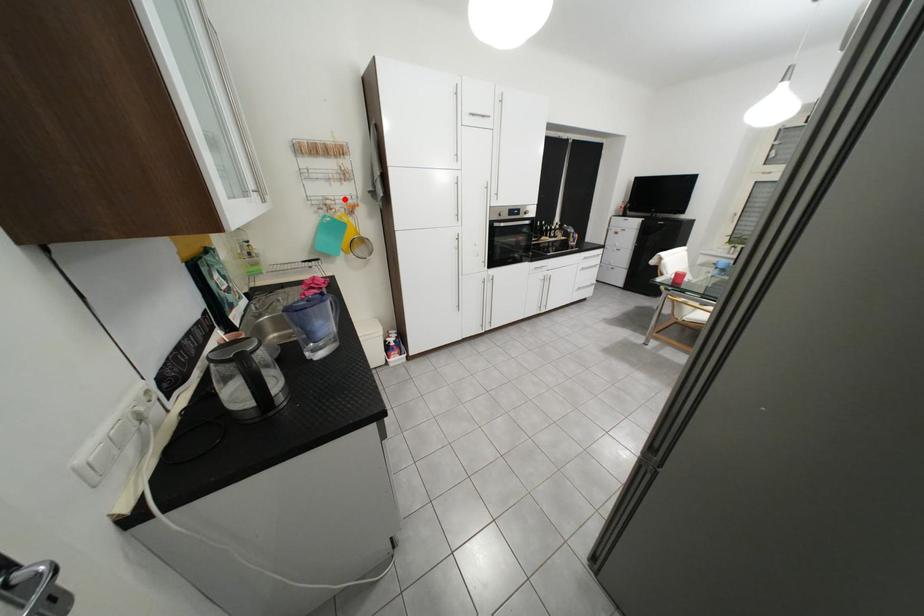
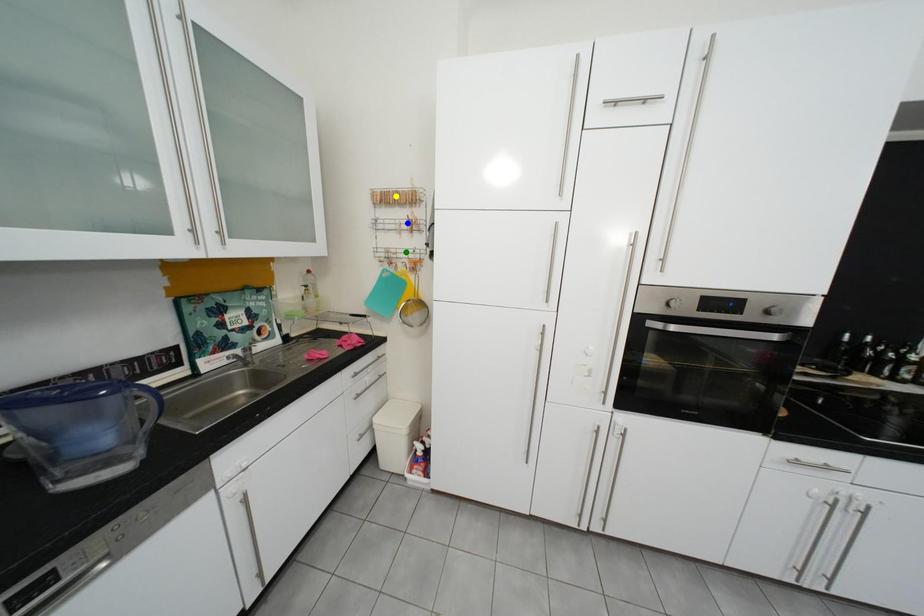
Question: I am providing you with two images of the same scene from different viewpoints. A red point is marked on the first image. You are given multiple points on the second image. Which spot in image 2 lines up with the point in image 1?

Choices:
 (A) yellow point
 (B) green point
 (C) blue point

Answer: (B)